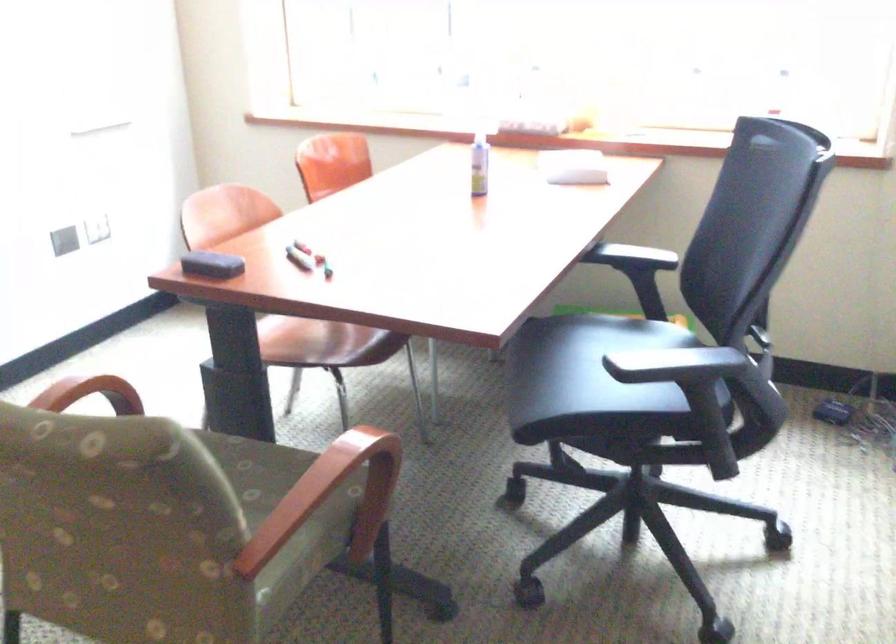
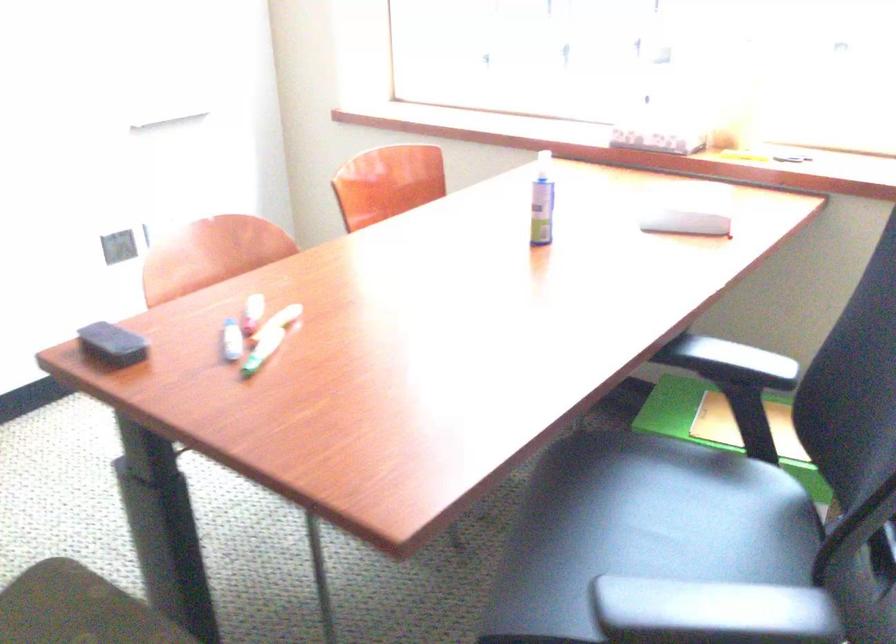
Question: Based on the continuous images, in which direction is the camera rotating? Reply with the corresponding letter.

Choices:
 (A) Left
 (B) Right
 (C) Up
 (D) Down

Answer: (A)